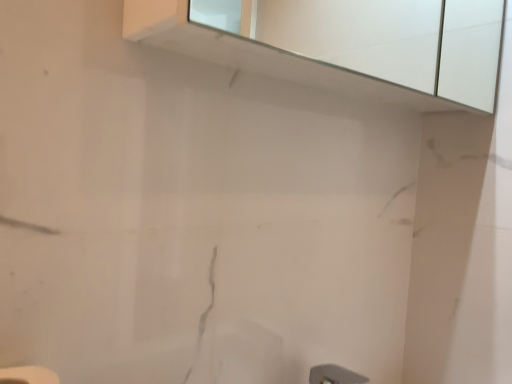
In order to click on white glossy mirror at upper center in this screenshot , I will do tap(379, 40).

What is the approximate width of white glossy mirror at upper center?

It is 6.33 inches.

The image size is (512, 384). Describe the element at coordinates (379, 40) in the screenshot. I see `white glossy mirror at upper center` at that location.

Find the location of `white glossy mirror at upper center`. white glossy mirror at upper center is located at coordinates (379, 40).